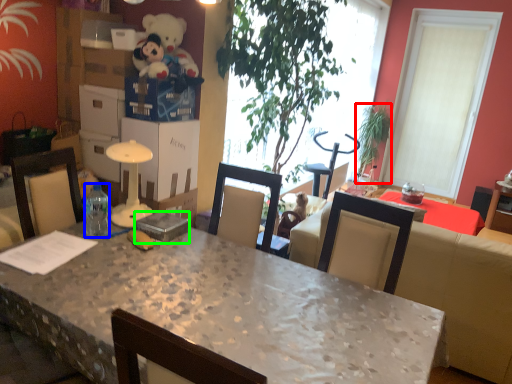
Question: Based on their relative distances, which object is farther from houseplant (highlighted by a red box)? Choose from bottle (highlighted by a blue box) and box (highlighted by a green box).

Choices:
 (A) bottle
 (B) box

Answer: (A)